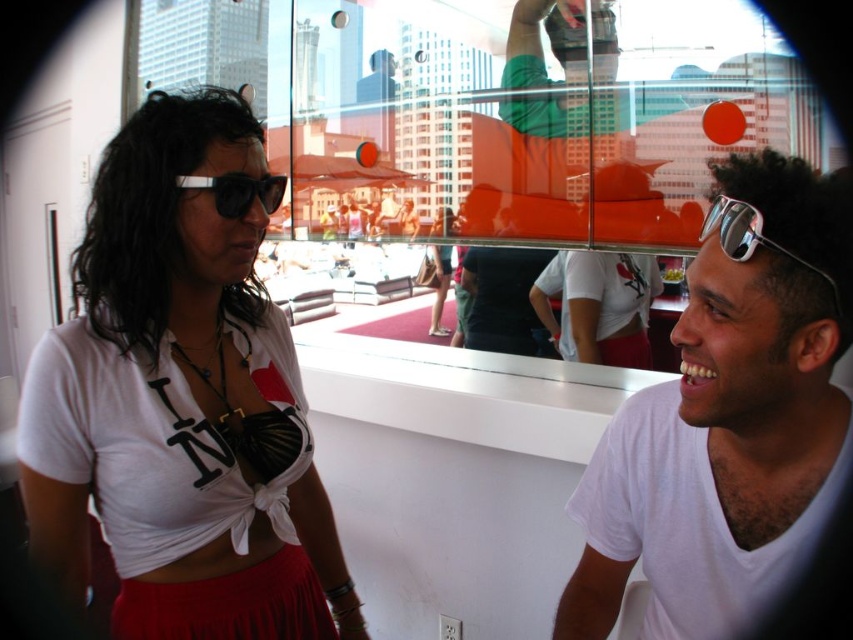
This screenshot has height=640, width=853. Describe the element at coordinates (729, 417) in the screenshot. I see `white matte shirt at right` at that location.

Is white matte shirt at right above silver reflective sunglasses at right?

No.

The height and width of the screenshot is (640, 853). What do you see at coordinates (729, 417) in the screenshot? I see `white matte shirt at right` at bounding box center [729, 417].

This screenshot has width=853, height=640. I want to click on white matte shirt at right, so click(729, 417).

Which of these two, white matte shirt at left or silver reflective sunglasses at right, stands shorter?

Standing shorter between the two is silver reflective sunglasses at right.

Which of these two, white matte shirt at left or silver reflective sunglasses at right, stands taller?

Standing taller between the two is white matte shirt at left.

I want to click on white matte shirt at left, so click(x=181, y=403).

Locate an element on the screen. The image size is (853, 640). white matte shirt at left is located at coordinates (181, 403).

Can you confirm if white matte shirt at left is bigger than matte black sunglasses at left?

Yes, white matte shirt at left is bigger than matte black sunglasses at left.

Is white matte shirt at left wider than matte black sunglasses at left?

Yes, white matte shirt at left is wider than matte black sunglasses at left.

Which is behind, point (70, 540) or point (224, 182)?

Positioned behind is point (70, 540).

I want to click on white matte shirt at left, so click(x=181, y=403).